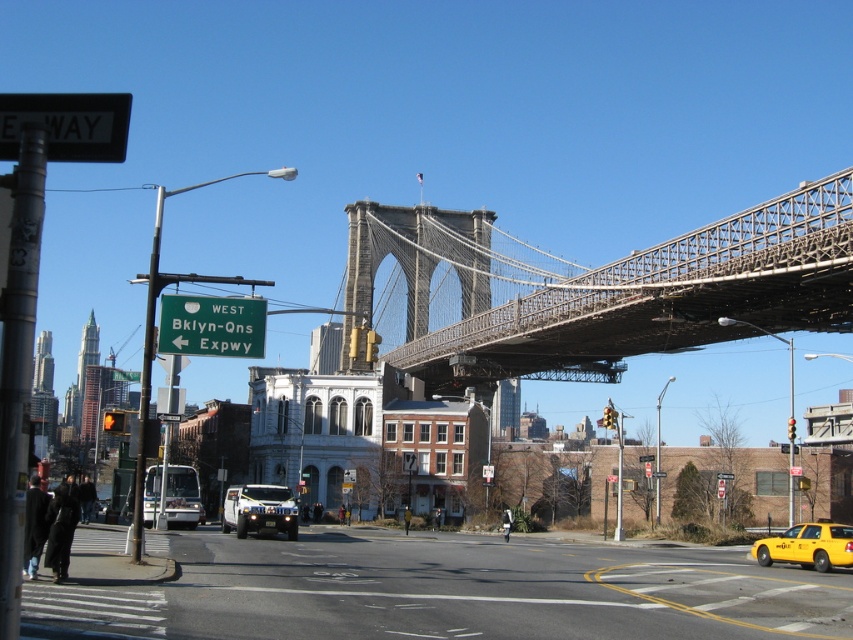
You are a pedestrian standing at the intersection near the green road sign. You need to cross the street to reach the Brooklyn Bridge. The yellow matte taxi at lower right is approaching from the left, and the white matte suv at center is coming from the opposite direction. Considering their distance apart, do you think it is safe to cross now?

The yellow matte taxi at lower right and the white matte suv at center are 106.74 feet apart. Since they are relatively far apart, it might be safe to cross the street now, but caution is advised as vehicles can accelerate or decelerate unexpectedly.

In the scene shown: You are a city planner assessing the visibility of traffic lights. Given that the yellow plastic traffic light at center and the red glass traffic light at upper center are both present, which one do you think is smaller in size?

The yellow plastic traffic light at center occupies less space than the red glass traffic light at upper center, so it is smaller in size.